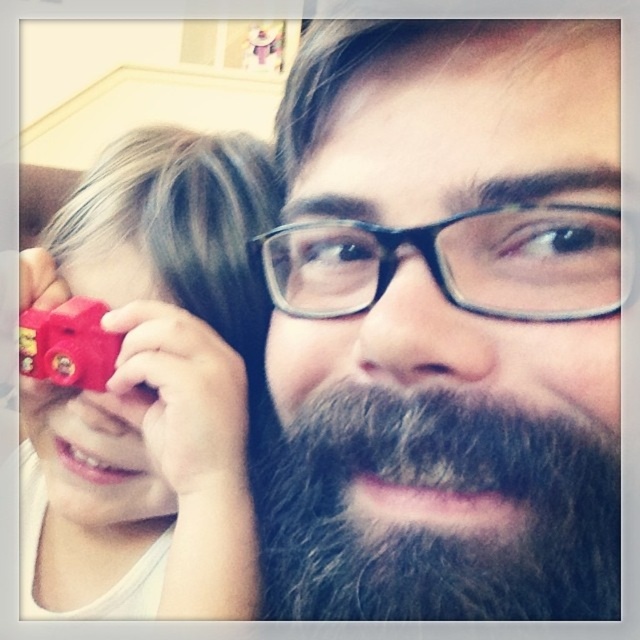
You are a parent trying to pack two toys into a small box. The box can only fit items that are narrower than 10 centimeters. You have the rubberized red toy camera at left and the rubberized plastic train at left. Which toy is wider and cannot be placed into the box?

The rubberized red toy camera at left is wider than the rubberized plastic train at left. Since the box requires items narrower than 10 centimeters, the rubberized red toy camera at left might not fit if its width exceeds 10 cm. However, without specific measurements, we can only confirm that the rubberized red toy camera at left is wider than the train.

You are a photographer trying to capture the scene where the dark brown beard at center and the rubberized red toy camera at left are positioned. Based on their spatial relationship, which object is located higher in the image?

The dark brown beard at center is above the rubberized red toy camera at left, so it is positioned higher in the image.

You are a photographer trying to capture a clear shot of the rubberized red toy camera at left and the rubberized plastic train at left. Which object should you focus on to ensure the one closer to you is sharp?

The rubberized red toy camera at left is closer to the viewer than the rubberized plastic train at left, so you should focus on the rubberized red toy camera at left to ensure it is sharp.